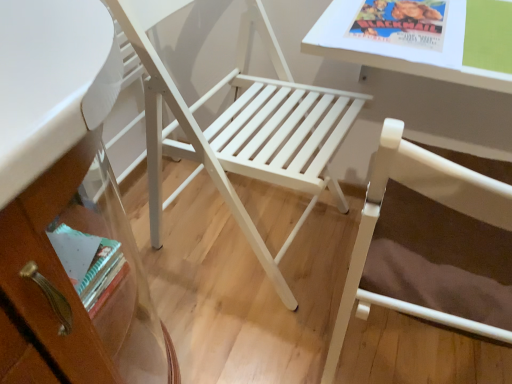
Question: Could white wood chair at center, placed as the first chair when sorted from left to right, be considered to be inside white glossy table at upper right?

Choices:
 (A) yes
 (B) no

Answer: (B)

Question: Is white glossy table at upper right shorter than white wood chair at center, which is the second chair from right to left?

Choices:
 (A) yes
 (B) no

Answer: (A)

Question: From the image's perspective, is white glossy table at upper right located above white wood chair at center, placed as the first chair when sorted from left to right?

Choices:
 (A) yes
 (B) no

Answer: (A)

Question: From the image's perspective, is white glossy table at upper right beneath white wood chair at center, which is the second chair from right to left?

Choices:
 (A) yes
 (B) no

Answer: (B)

Question: Does white glossy table at upper right have a lesser width compared to white wood chair at center, which is the second chair from right to left?

Choices:
 (A) yes
 (B) no

Answer: (A)

Question: From a real-world perspective, does white glossy table at upper right sit lower than white wood chair at center, placed as the first chair when sorted from left to right?

Choices:
 (A) yes
 (B) no

Answer: (B)

Question: From a real-world perspective, is white wood chair at center, which is the second chair from right to left, below white glossy table at upper right?

Choices:
 (A) yes
 (B) no

Answer: (A)

Question: Can you confirm if white wood chair at center, which is the second chair from right to left, is positioned to the right of white glossy table at upper right?

Choices:
 (A) no
 (B) yes

Answer: (A)

Question: Is white wood chair at center, placed as the first chair when sorted from left to right, far from white glossy table at upper right?

Choices:
 (A) yes
 (B) no

Answer: (B)

Question: Is white wood chair at center, placed as the first chair when sorted from left to right, to the left of white glossy table at upper right from the viewer's perspective?

Choices:
 (A) no
 (B) yes

Answer: (B)

Question: From the image's perspective, is white wood chair at center, placed as the first chair when sorted from left to right, beneath white glossy table at upper right?

Choices:
 (A) yes
 (B) no

Answer: (A)

Question: Is white wood chair at center, placed as the first chair when sorted from left to right, bigger than white glossy table at upper right?

Choices:
 (A) no
 (B) yes

Answer: (B)

Question: Considering the relative sizes of white wood chair at center, which is the second chair from right to left, and white wood chair at center, which is counted as the second chair, starting from the left, in the image provided, is white wood chair at center, which is the second chair from right to left, wider than white wood chair at center, which is counted as the second chair, starting from the left,?

Choices:
 (A) no
 (B) yes

Answer: (B)